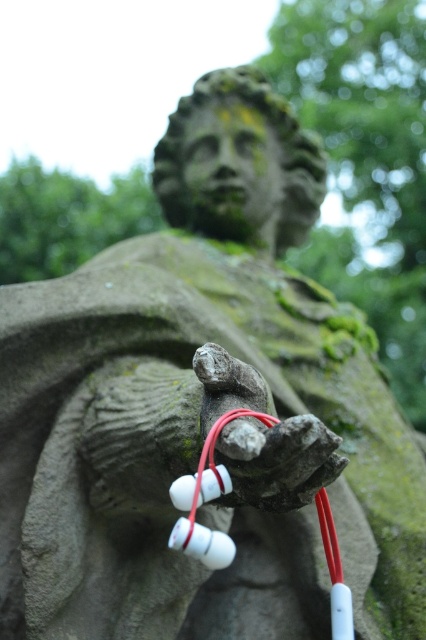
Question: Does smooth stone hand at center appear under white plastic earphones at center?

Choices:
 (A) no
 (B) yes

Answer: (A)

Question: Does smooth stone hand at center appear under white plastic earphones at center?

Choices:
 (A) yes
 (B) no

Answer: (B)

Question: Can you confirm if smooth stone hand at center is smaller than white plastic earphones at center?

Choices:
 (A) yes
 (B) no

Answer: (A)

Question: Which object is farther from the camera taking this photo?

Choices:
 (A) smooth stone hand at center
 (B) white plastic earphones at center

Answer: (A)